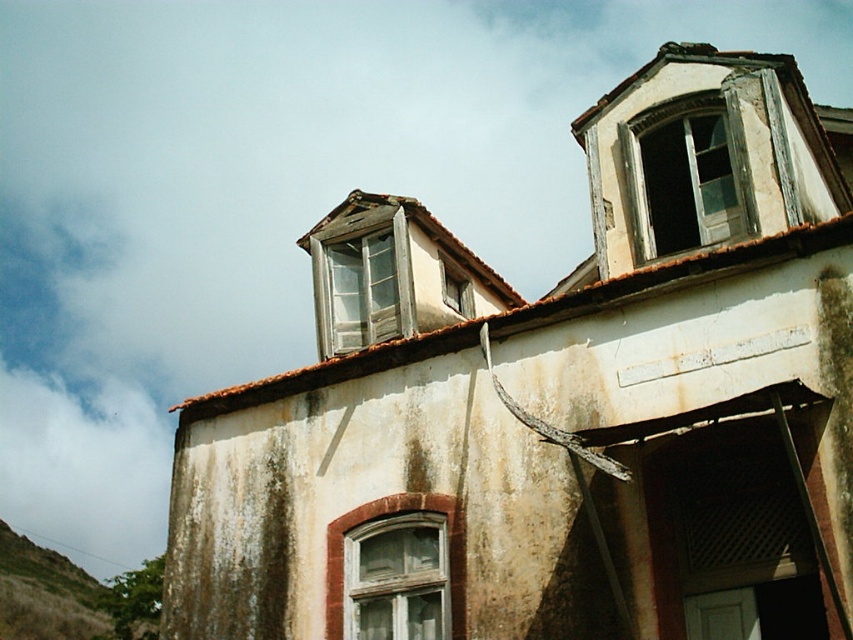
Question: Which is farther from the wooden window at upper right?

Choices:
 (A) wooden window at center
 (B) matte glass window at upper center

Answer: (A)

Question: Can you confirm if wooden window at upper right is wider than wooden window at center?

Choices:
 (A) no
 (B) yes

Answer: (B)

Question: Does wooden window at upper right lie in front of matte glass window at upper center?

Choices:
 (A) yes
 (B) no

Answer: (A)

Question: Which of these objects is positioned farthest from the transparent glass window at center?

Choices:
 (A) wooden window at upper right
 (B) wooden window at center

Answer: (B)

Question: Does wooden window at center have a larger size compared to matte glass window at upper center?

Choices:
 (A) no
 (B) yes

Answer: (B)

Question: Among these points, which one is nearest to the camera?

Choices:
 (A) (355, 300)
 (B) (717, 100)
 (C) (416, 621)
 (D) (445, 292)

Answer: (C)